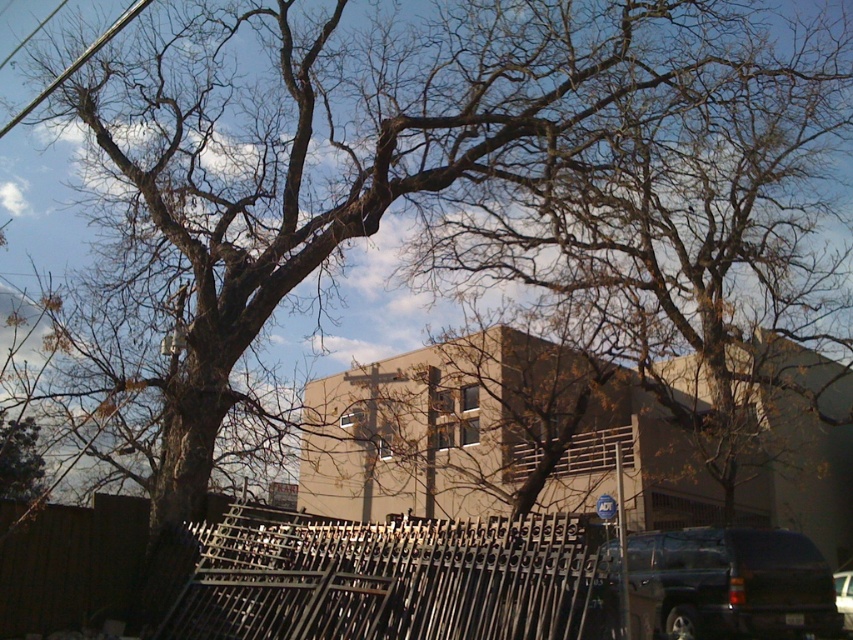
You are a delivery driver who needs to park your vehicle in the parking spot near the large tree. There are two SUVs present in the scene. According to the image, which SUV, the matte black suv at lower right or the shiny black suv at lower right, is blocking the parking spot?

The matte black suv at lower right is positioned over the shiny black suv at lower right, so the matte black suv at lower right is blocking the parking spot.

You are standing at the edge of the scene and want to walk towards the matte black suv at lower right. Which direction should you move relative to the metallic silver fence at lower center?

You should move to the right of the metallic silver fence at lower center because the matte black suv at lower right is positioned to the right side of the metallic silver fence at lower center.

You are a delivery driver trying to park your shiny black suv at lower right in a narrow space next to the matte black suv at lower right. Based on the scene, can you determine if there is enough space for your vehicle?

The matte black suv at lower right might be wider than the shiny black suv at lower right, so there may not be enough space for the shiny black suv at lower right to park next to it.